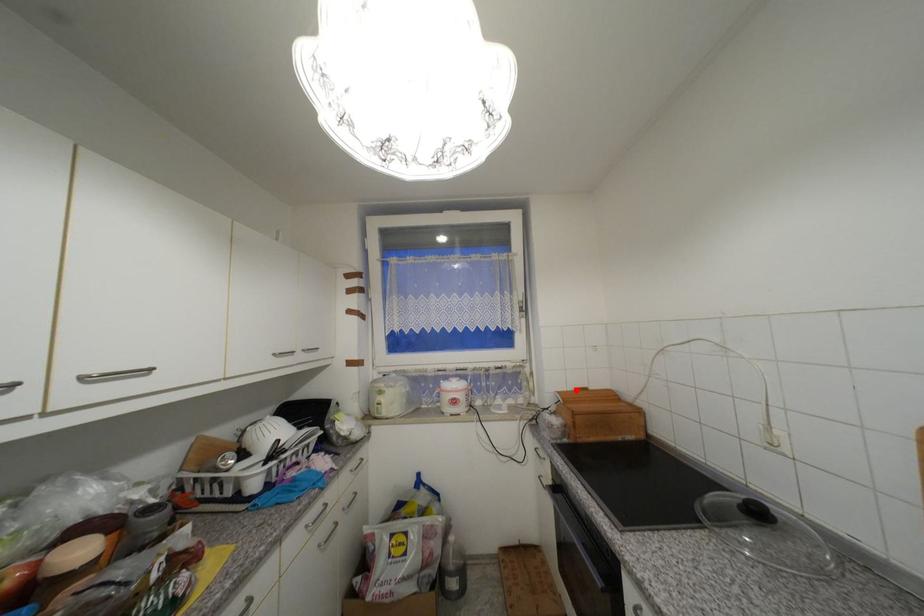
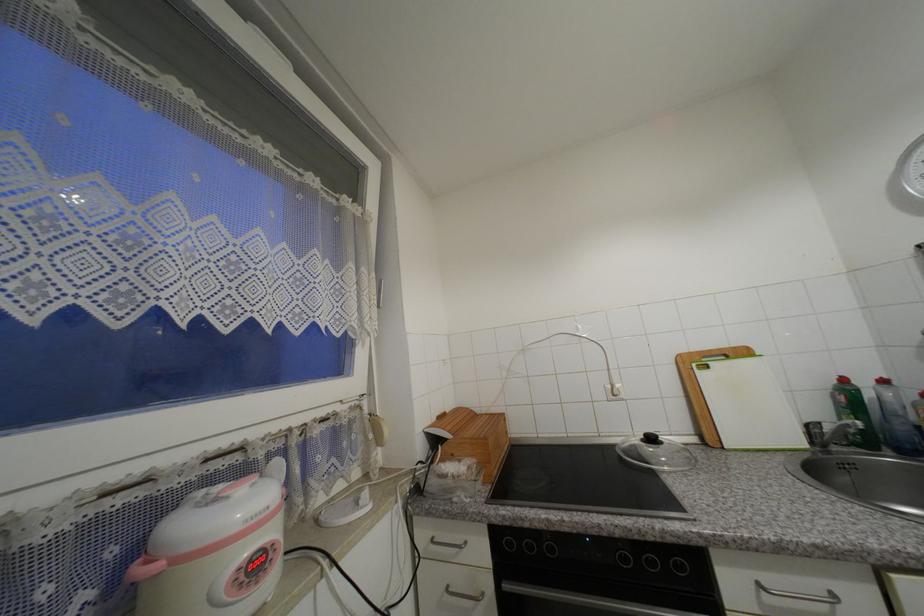
Find the pixel in the second image that matches the highlighted location in the first image.

(440, 419)